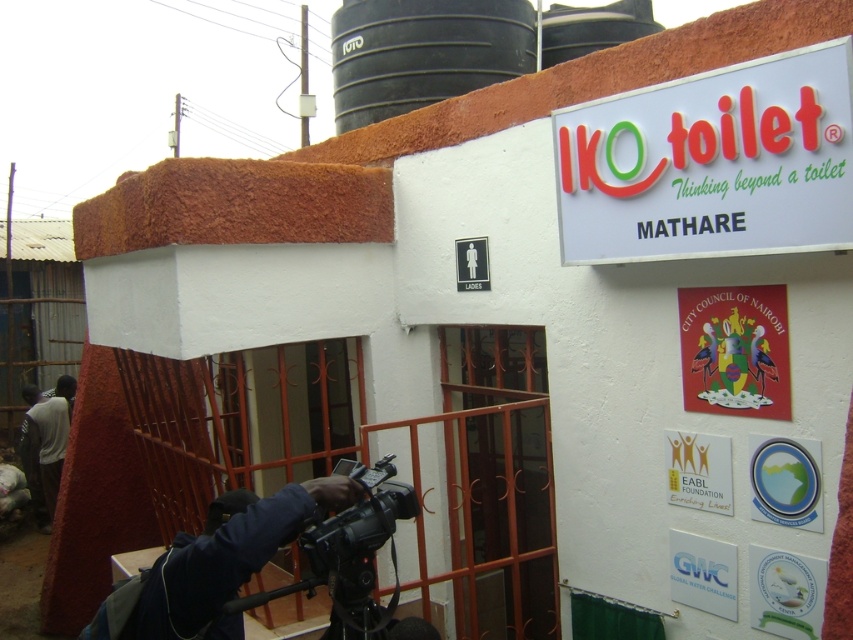
Question: Does black plastic video camera at lower center lie behind dark gray fabric shirt at lower left?

Choices:
 (A) no
 (B) yes

Answer: (A)

Question: In this image, where is white plastic sign at upper right located relative to black plastic video camera at lower center?

Choices:
 (A) below
 (B) above

Answer: (B)

Question: Can you confirm if white plastic sign at upper right is positioned to the left of black plastic video camera at lower center?

Choices:
 (A) no
 (B) yes

Answer: (A)

Question: Which of these objects is positioned farthest from the dark gray fabric shirt at lower left?

Choices:
 (A) black plastic video camera at lower center
 (B) white plastic sign at upper right

Answer: (B)

Question: Which object is closer to the camera taking this photo?

Choices:
 (A) dark gray fabric shirt at lower left
 (B) black plastic video camera at lower center
 (C) white plastic sign at upper right

Answer: (C)

Question: Which object is positioned closest to the dark gray fabric shirt at lower left?

Choices:
 (A) white plastic sign at upper right
 (B) black plastic video camera at lower center

Answer: (B)